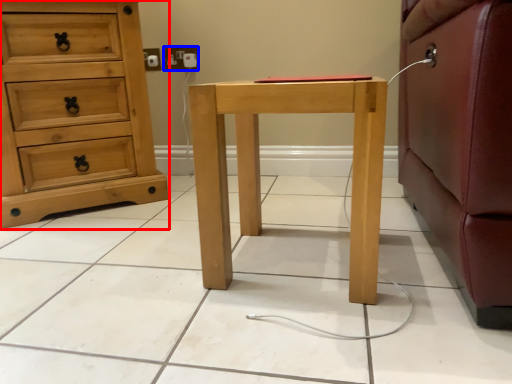
Question: Which point is further to the camera, chest of drawers (highlighted by a red box) or electric outlet (highlighted by a blue box)?

Choices:
 (A) chest of drawers
 (B) electric outlet

Answer: (B)